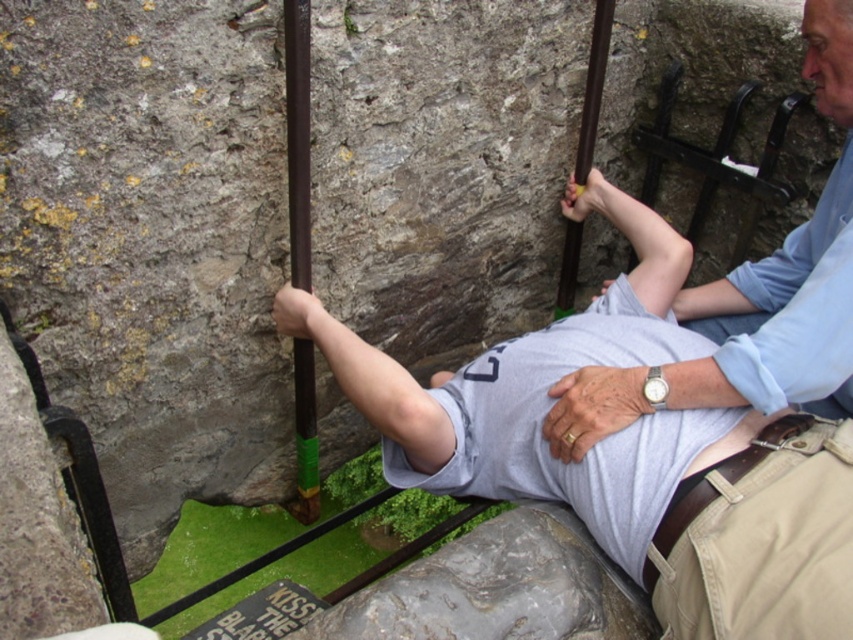
In the scene shown: You are standing at the point marked as point (630, 452) in the image. What object are you touching?

The point (630, 452) is on the gray cotton shirt at center, so you are touching the gray cotton shirt at center.

You are a photographer trying to capture both the gray cotton shirt at center and the light blue cotton shirt at upper right in a single frame. Based on their positions, which one is closer to the camera?

The gray cotton shirt at center is positioned under the light blue cotton shirt at upper right, meaning it is closer to the camera.